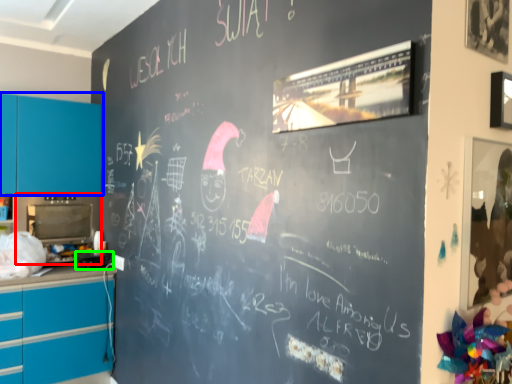
Question: Which is farther away from appliance (highlighted by a red box)? cabinetry (highlighted by a blue box) or appliance (highlighted by a green box)?

Choices:
 (A) cabinetry
 (B) appliance

Answer: (B)